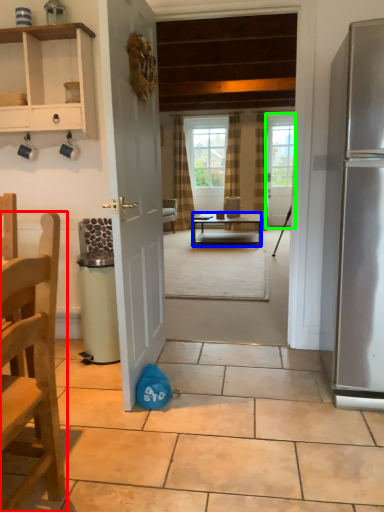
Question: Which object is positioned farthest from chair (highlighted by a red box)? Select from desk (highlighted by a blue box) and door (highlighted by a green box).

Choices:
 (A) desk
 (B) door

Answer: (B)